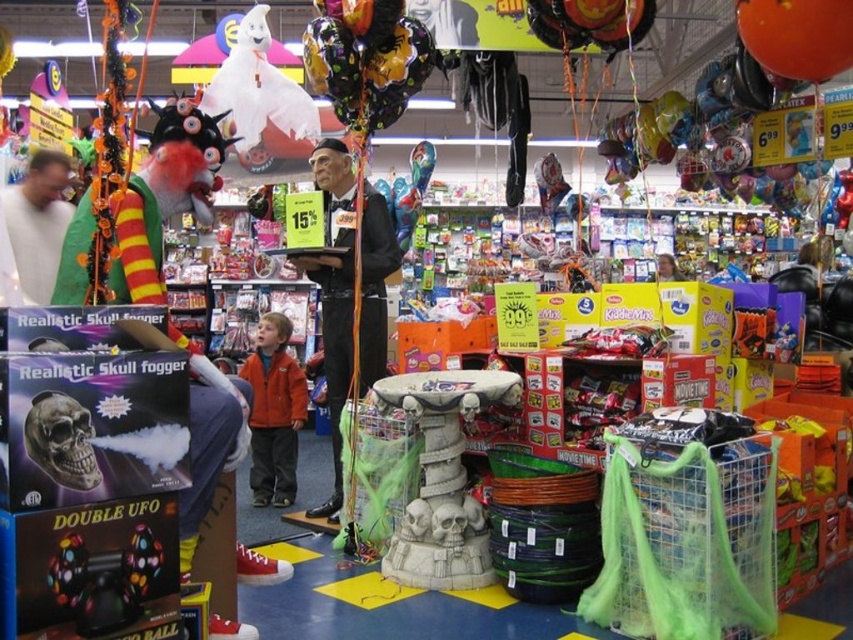
Question: Is stone-like skull fountain at center closer to the viewer compared to orange fleece jacket at center?

Choices:
 (A) yes
 (B) no

Answer: (A)

Question: Does stone-like skull fountain at center appear on the right side of orange fleece jacket at center?

Choices:
 (A) yes
 (B) no

Answer: (A)

Question: Which of these objects is positioned farthest from the stone-like skull fountain at center?

Choices:
 (A) orange fleece jacket at center
 (B) black glossy statue at center

Answer: (A)

Question: Among these objects, which one is farthest from the camera?

Choices:
 (A) black glossy statue at center
 (B) orange fleece jacket at center
 (C) stone-like skull fountain at center

Answer: (B)

Question: Is stone-like skull fountain at center below orange fleece jacket at center?

Choices:
 (A) no
 (B) yes

Answer: (B)

Question: Which object is positioned farthest from the orange fleece jacket at center?

Choices:
 (A) black glossy statue at center
 (B) stone-like skull fountain at center

Answer: (B)